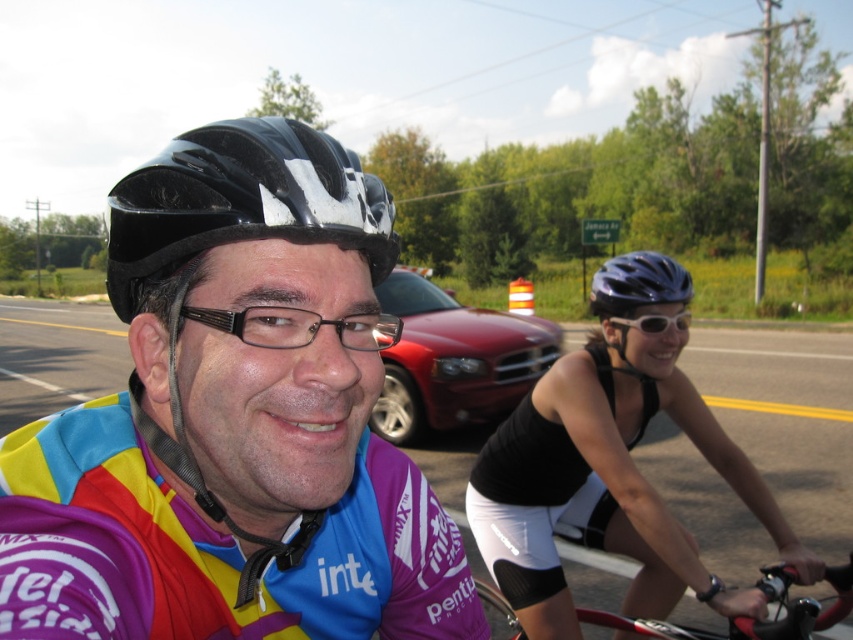
Does black matte helmet at center have a lesser height compared to black matte helmet at upper center?

No, black matte helmet at center is not shorter than black matte helmet at upper center.

In the scene shown: Does black matte helmet at center appear over black matte helmet at upper center?

No, black matte helmet at center is not above black matte helmet at upper center.

Is point (779, 512) behind point (664, 298)?

Yes, point (779, 512) is behind point (664, 298).

You are a GUI agent. You are given a task and a screenshot of the screen. Output one action in this format:
    pyautogui.click(x=<x>, y=<y>)
    Task: Click on the black matte helmet at center
    
    Given the screenshot: What is the action you would take?
    pyautogui.click(x=610, y=467)

Is black matte bicycle helmet at center further to the viewer compared to white matte sunglasses at center?

No, it is not.

Is black matte bicycle helmet at center to the right of white matte sunglasses at center from the viewer's perspective?

In fact, black matte bicycle helmet at center is to the left of white matte sunglasses at center.

The height and width of the screenshot is (640, 853). I want to click on black matte bicycle helmet at center, so click(x=241, y=202).

You are a GUI agent. You are given a task and a screenshot of the screen. Output one action in this format:
    pyautogui.click(x=<x>, y=<y>)
    Task: Click on the black matte bicycle helmet at center
    
    Given the screenshot: What is the action you would take?
    pyautogui.click(x=241, y=202)

Between matte cycling jersey at center and white matte sunglasses at center, which one is positioned lower?

matte cycling jersey at center

Can you confirm if matte cycling jersey at center is bigger than white matte sunglasses at center?

Yes.

Where is `matte cycling jersey at center`? The image size is (853, 640). matte cycling jersey at center is located at coordinates (234, 424).